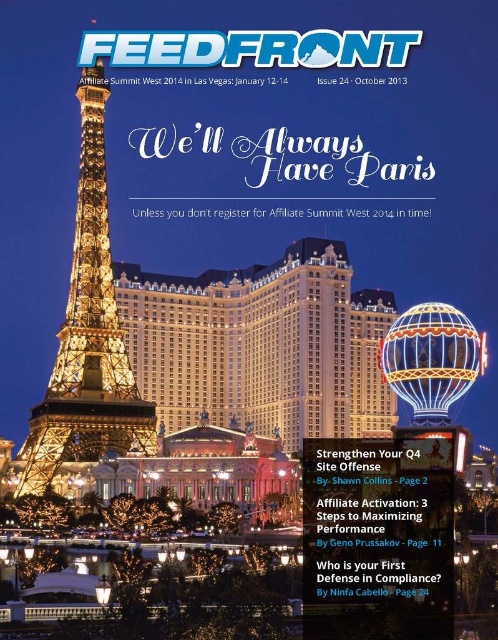
From the picture: You are planning to take a photo of the illuminated glass hotel at center and the illuminated steel eiffel tower at left from a distance. Which object would appear wider in the photo?

The illuminated glass hotel at center might appear wider than the illuminated steel eiffel tower at left according to the description.